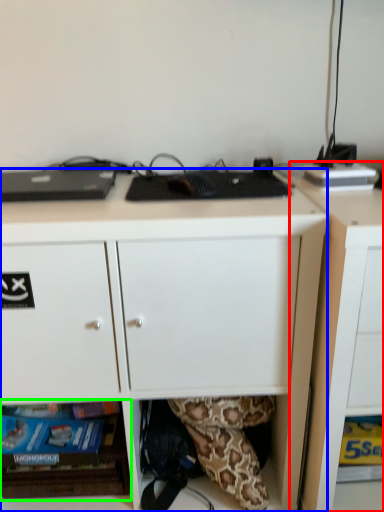
Question: Which object is positioned closest to cabinetry (highlighted by a red box)? Select from desk (highlighted by a blue box) and shelf (highlighted by a green box).

Choices:
 (A) desk
 (B) shelf

Answer: (A)